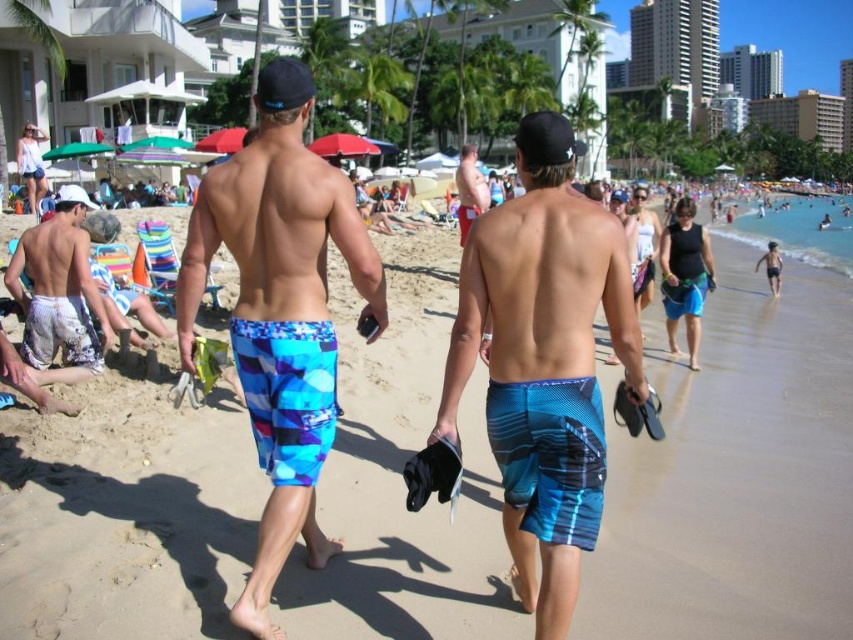
You are a photographer trying to capture a closeup shot of the boardshorts. Which pair of boardshorts, the blue textured boardshorts at center or the blue printed boardshorts at center, would require you to move closer to get a clear photo?

The blue textured boardshorts at center is smaller than the blue printed boardshorts at center, so you would need to move closer to the blue textured boardshorts at center to capture a clear photo.